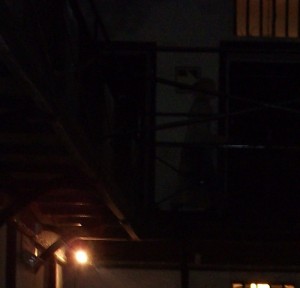
You are a GUI agent. You are given a task and a screenshot of the screen. Output one action in this format:
    pyautogui.click(x=<x>, y=<y>)
    Task: Click on the window
    
    Given the screenshot: What is the action you would take?
    pyautogui.click(x=256, y=286), pyautogui.click(x=271, y=21)